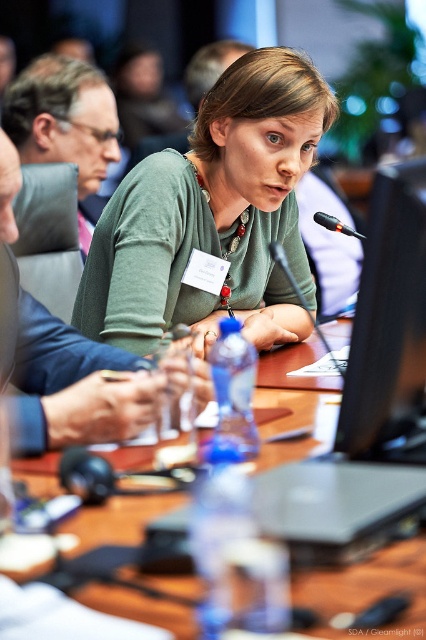
Question: Among these objects, which one is nearest to the camera?

Choices:
 (A) wooden table at center
 (B) green matte shirt at center
 (C) black glossy monitor at center right

Answer: (A)

Question: Is black glossy monitor at center right wider than wooden table at center?

Choices:
 (A) yes
 (B) no

Answer: (B)

Question: Which of the following is the farthest from the observer?

Choices:
 (A) (126, 454)
 (B) (114, 266)

Answer: (B)

Question: Does black glossy monitor at center right have a lesser width compared to wooden table at center?

Choices:
 (A) yes
 (B) no

Answer: (A)

Question: Is black glossy monitor at center right smaller than wooden table at center?

Choices:
 (A) no
 (B) yes

Answer: (B)

Question: Which point appears closest to the camera in this image?

Choices:
 (A) (273, 392)
 (B) (354, 380)
 (C) (299, 150)

Answer: (B)